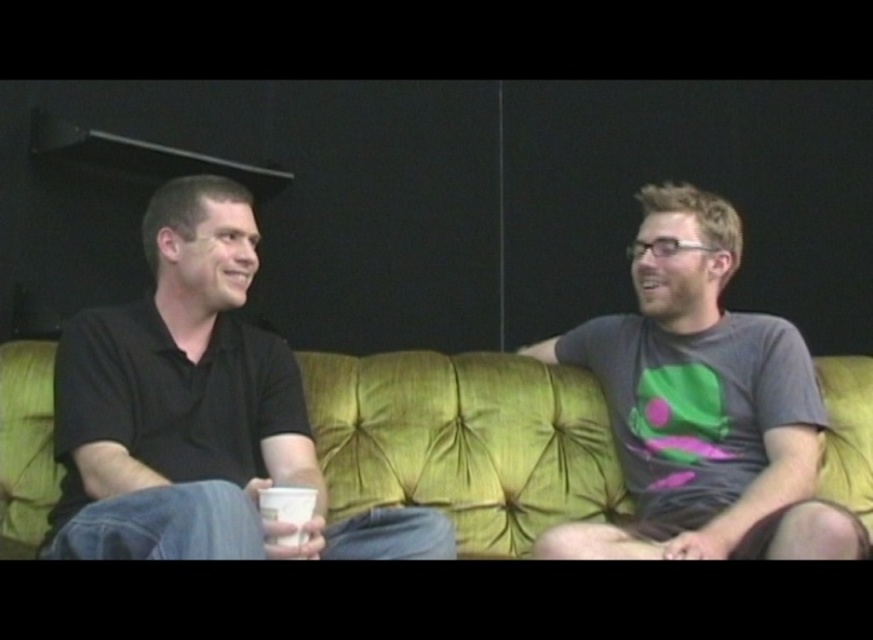
Between gray matte t-shirt at right and white paper cup at center, which one appears on the left side from the viewer's perspective?

Positioned to the left is white paper cup at center.

Is point (780, 404) positioned behind point (294, 545)?

Yes, it is behind point (294, 545).

The image size is (873, 640). Identify the location of gray matte t-shirt at right. (702, 406).

This screenshot has height=640, width=873. In order to click on black matte shirt at left in this screenshot , I will do `click(197, 412)`.

Does black matte shirt at left have a smaller size compared to gray matte t-shirt at right?

Correct, black matte shirt at left occupies less space than gray matte t-shirt at right.

You are a GUI agent. You are given a task and a screenshot of the screen. Output one action in this format:
    pyautogui.click(x=<x>, y=<y>)
    Task: Click on the black matte shirt at left
    Image resolution: width=873 pixels, height=640 pixels.
    Given the screenshot: What is the action you would take?
    pyautogui.click(x=197, y=412)

Is black matte shirt at left above green fabric couch at center?

Yes.

Find the location of a particular element. black matte shirt at left is located at coordinates point(197,412).

Locate an element on the screen. black matte shirt at left is located at coordinates (197, 412).